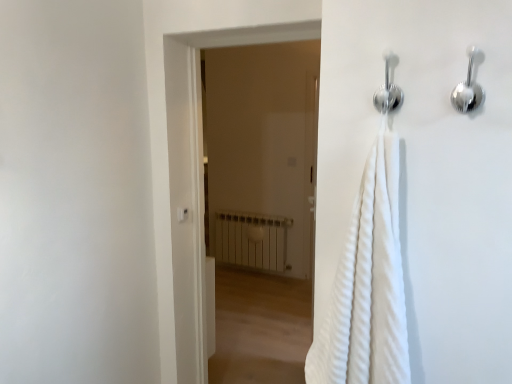
Question: In terms of height, does chrome metallic shower at upper center, the first shower from the left, look taller or shorter compared to satin silver shower at upper right, the 1th shower when ordered from right to left?

Choices:
 (A) tall
 (B) short

Answer: (A)

Question: Looking at their shapes, would you say chrome metallic shower at upper center, the first shower from the left, is wider or thinner than satin silver shower at upper right, which appears as the second shower when viewed from the left?

Choices:
 (A) wide
 (B) thin

Answer: (A)

Question: Which object is positioned closest to the white matte radiator at center?

Choices:
 (A) chrome metallic shower at upper center, which appears as the second shower when viewed from the right
 (B) white matte radiator at center
 (C) white plastic light switch at upper center
 (D) satin silver shower at upper right, the 1th shower when ordered from right to left

Answer: (B)

Question: Which object is positioned closest to the white matte radiator at center?

Choices:
 (A) chrome metallic shower at upper center, which appears as the second shower when viewed from the right
 (B) white plastic light switch at upper center
 (C) satin silver shower at upper right, the 1th shower when ordered from right to left
 (D) white matte radiator at center

Answer: (D)